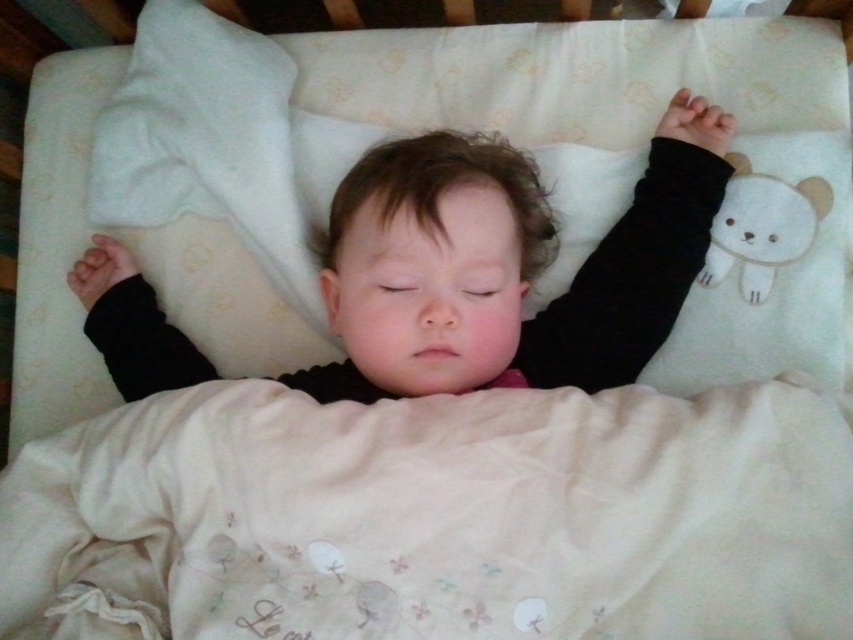
You are a photographer setting up a crib for a newborn session. The crib has a soft cream fabric at center and a smooth skin baby at center. Which object is shorter in height?

The soft cream fabric at center is shorter than the smooth skin baby at center.

You are a photographer setting up a shot of the baby. You need to position a light source to the right of the white plush bear at upper right. Will the light hit the soft cream fabric at center?

The soft cream fabric at center is to the left of the white plush bear at upper right. Since the light is placed to the right of the bear, the light will not hit the soft cream fabric at center.

You are a photographer setting up a studio for a baby photo shoot. The scene includes a smooth skin baby at center and a white plush bear at upper right. You need to ensure the baby is the main focus. Given their sizes, which object should you adjust the lighting to highlight more?

The smooth skin baby at center is larger in size than the white plush bear at upper right, so you should adjust the lighting to highlight the smooth skin baby at center more to ensure it remains the main focus.